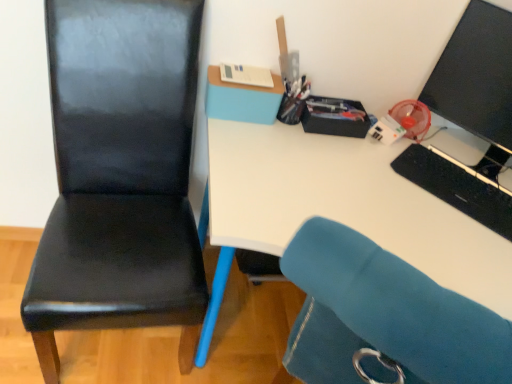
The width and height of the screenshot is (512, 384). Find the location of `vacant space to the left of black matte keyboard at right`. vacant space to the left of black matte keyboard at right is located at coordinates (382, 188).